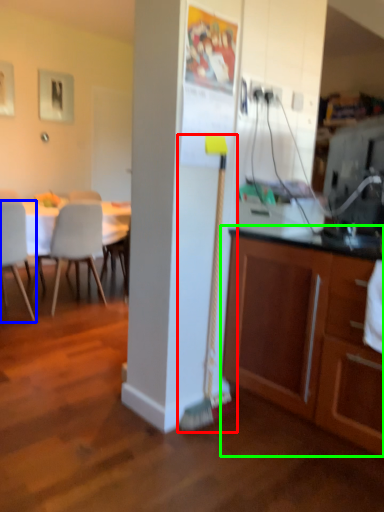
Question: Which object is positioned closest to brush (highlighted by a red box)? Select from chair (highlighted by a blue box) and cabinetry (highlighted by a green box).

Choices:
 (A) chair
 (B) cabinetry

Answer: (B)